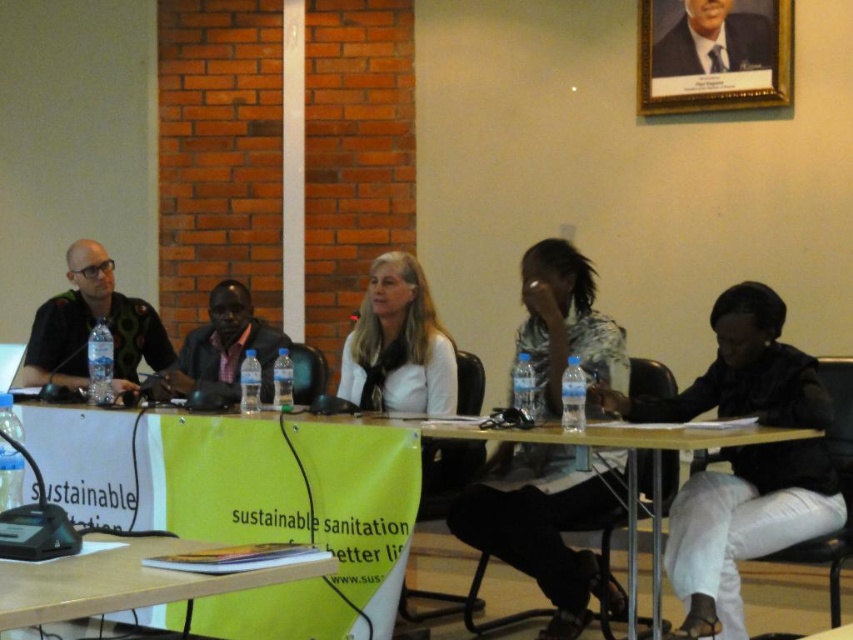
Is green fabric banner at center further to the viewer compared to patterned fabric shirt at center?

Yes, green fabric banner at center is further from the viewer.

Is point (149, 468) in front of point (556, 502)?

That is False.

Where is `green fabric banner at center`? green fabric banner at center is located at coordinates (171, 472).

Can you confirm if black matte jacket at lower right is positioned above matte black shirt at center?

Actually, black matte jacket at lower right is below matte black shirt at center.

Can you confirm if black matte jacket at lower right is thinner than matte black shirt at center?

Incorrect, black matte jacket at lower right's width is not less than matte black shirt at center's.

Identify the location of black matte jacket at lower right. The width and height of the screenshot is (853, 640). (744, 525).

Is green fabric banner at center thinner than wooden framed portrait at upper right?

Incorrect, green fabric banner at center's width is not less than wooden framed portrait at upper right's.

Does green fabric banner at center have a greater height compared to wooden framed portrait at upper right?

Yes.

Which is behind, point (155, 618) or point (757, 86)?

The point (757, 86) is behind.

Where is `green fabric banner at center`? The width and height of the screenshot is (853, 640). green fabric banner at center is located at coordinates (171, 472).